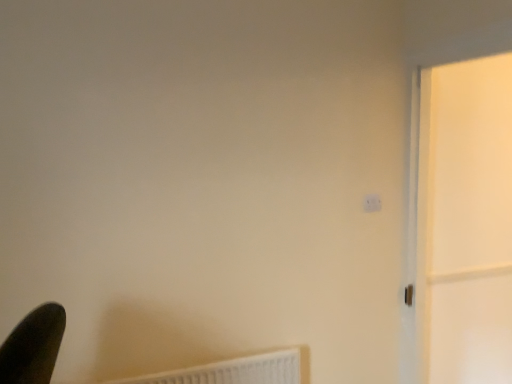
Question: Is white plastic radiator at lower left taller or shorter than white plastic light switch at upper right?

Choices:
 (A) tall
 (B) short

Answer: (A)

Question: From a real-world perspective, is white plastic radiator at lower left above or below white plastic light switch at upper right?

Choices:
 (A) above
 (B) below

Answer: (B)

Question: Which object is positioned closest to the white glossy screen door at right?

Choices:
 (A) white plastic radiator at lower left
 (B) white plastic light switch at upper right

Answer: (B)

Question: Estimate the real-world distances between objects in this image. Which object is farther from the white glossy screen door at right?

Choices:
 (A) white plastic light switch at upper right
 (B) white plastic radiator at lower left

Answer: (B)